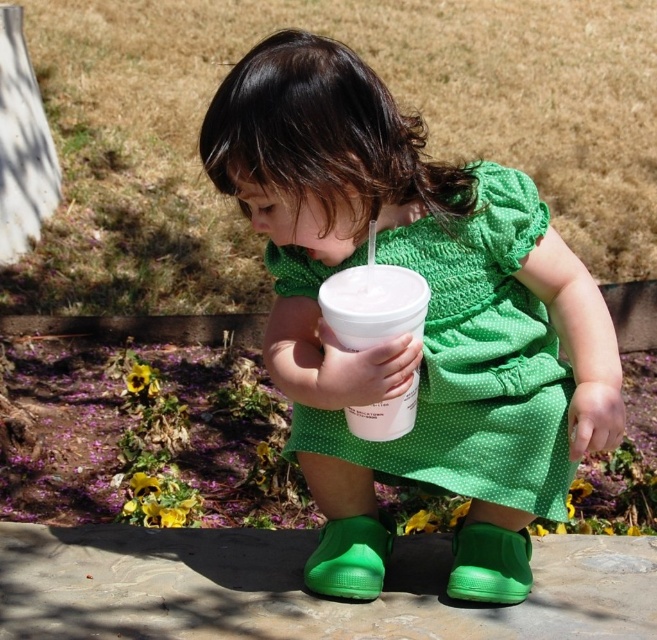
Question: Is green matte dress at center in front of white plastic cup at center?

Choices:
 (A) no
 (B) yes

Answer: (B)

Question: Is green matte dress at center thinner than green dotted dress at center?

Choices:
 (A) yes
 (B) no

Answer: (B)

Question: Which point is farther to the camera?

Choices:
 (A) green matte dress at center
 (B) white plastic cup at center

Answer: (B)

Question: Which of these objects is positioned closest to the green matte dress at center?

Choices:
 (A) white plastic cup at center
 (B) green dotted dress at center

Answer: (B)

Question: Which point is closer to the camera?

Choices:
 (A) (413, 412)
 (B) (275, 248)
 (C) (357, 106)

Answer: (C)

Question: Can you confirm if green dotted dress at center is positioned above white plastic cup at center?

Choices:
 (A) no
 (B) yes

Answer: (A)